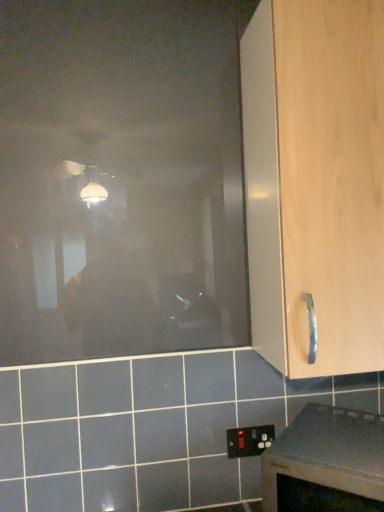
Question: From the image's perspective, does black plastic electric outlet at lower center appear lower than smooth gray countertop at lower right?

Choices:
 (A) yes
 (B) no

Answer: (B)

Question: Is black plastic electric outlet at lower center positioned beyond the bounds of smooth gray countertop at lower right?

Choices:
 (A) yes
 (B) no

Answer: (A)

Question: Considering the relative sizes of black plastic electric outlet at lower center and smooth gray countertop at lower right in the image provided, is black plastic electric outlet at lower center shorter than smooth gray countertop at lower right?

Choices:
 (A) no
 (B) yes

Answer: (B)

Question: Does black plastic electric outlet at lower center have a greater height compared to smooth gray countertop at lower right?

Choices:
 (A) yes
 (B) no

Answer: (B)

Question: Is black plastic electric outlet at lower center closer to camera compared to smooth gray countertop at lower right?

Choices:
 (A) yes
 (B) no

Answer: (B)

Question: From the image's perspective, relative to black plastic electric outlet at lower center, is smooth gray countertop at lower right above or below?

Choices:
 (A) below
 (B) above

Answer: (A)

Question: Considering the positions of smooth gray countertop at lower right and black plastic electric outlet at lower center in the image, is smooth gray countertop at lower right wider or thinner than black plastic electric outlet at lower center?

Choices:
 (A) thin
 (B) wide

Answer: (B)

Question: Considering the positions of point (306, 418) and point (251, 441), is point (306, 418) closer or farther from the camera than point (251, 441)?

Choices:
 (A) closer
 (B) farther

Answer: (A)

Question: In the image, is smooth gray countertop at lower right positioned in front of or behind black plastic electric outlet at lower center?

Choices:
 (A) front
 (B) behind

Answer: (A)

Question: Is transparent matte glass door at upper left inside or outside of light wood cabinet handle at right?

Choices:
 (A) inside
 (B) outside

Answer: (B)

Question: In the image, is transparent matte glass door at upper left positioned in front of or behind light wood cabinet handle at right?

Choices:
 (A) behind
 (B) front

Answer: (A)

Question: From the image's perspective, is transparent matte glass door at upper left above or below light wood cabinet handle at right?

Choices:
 (A) above
 (B) below

Answer: (A)

Question: Based on their sizes in the image, would you say transparent matte glass door at upper left is bigger or smaller than light wood cabinet handle at right?

Choices:
 (A) small
 (B) big

Answer: (A)

Question: From the image's perspective, is smooth gray countertop at lower right positioned above or below light wood cabinet handle at right?

Choices:
 (A) above
 (B) below

Answer: (B)

Question: In terms of height, does smooth gray countertop at lower right look taller or shorter compared to light wood cabinet handle at right?

Choices:
 (A) short
 (B) tall

Answer: (A)